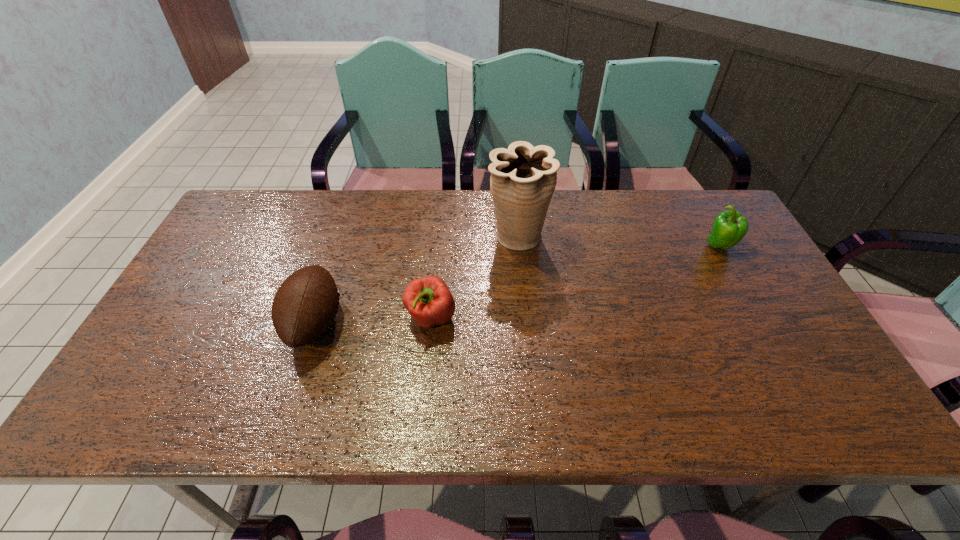
Locate an element on the screen. Image resolution: width=960 pixels, height=540 pixels. vacant point that satisfies the following two spatial constraints: 1. on the back side of the tallest object; 2. on the right side of the left bell pepper is located at coordinates (439, 237).

Identify the location of free space that satisfies the following two spatial constraints: 1. on the front side of the shorter bell pepper; 2. on the laces of the football. This screenshot has height=540, width=960. pyautogui.click(x=431, y=323).